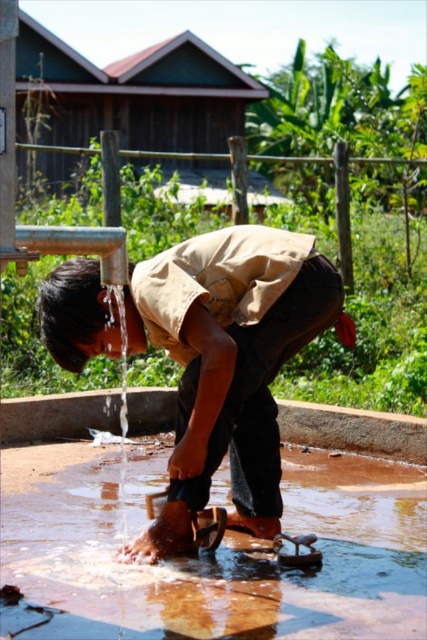
At what (x,y) coordinates should I click in order to perform the action: click on clear liquid water at lower center. Please return your answer as a coordinate pair (x, y). The image size is (427, 640). Looking at the image, I should click on (216, 554).

Who is higher up, clear liquid water at lower center or brown leather sandal at lower center?

brown leather sandal at lower center is above.

Does point (386, 552) lie in front of point (246, 353)?

No, it is behind (246, 353).

This screenshot has height=640, width=427. I want to click on clear liquid water at lower center, so click(216, 554).